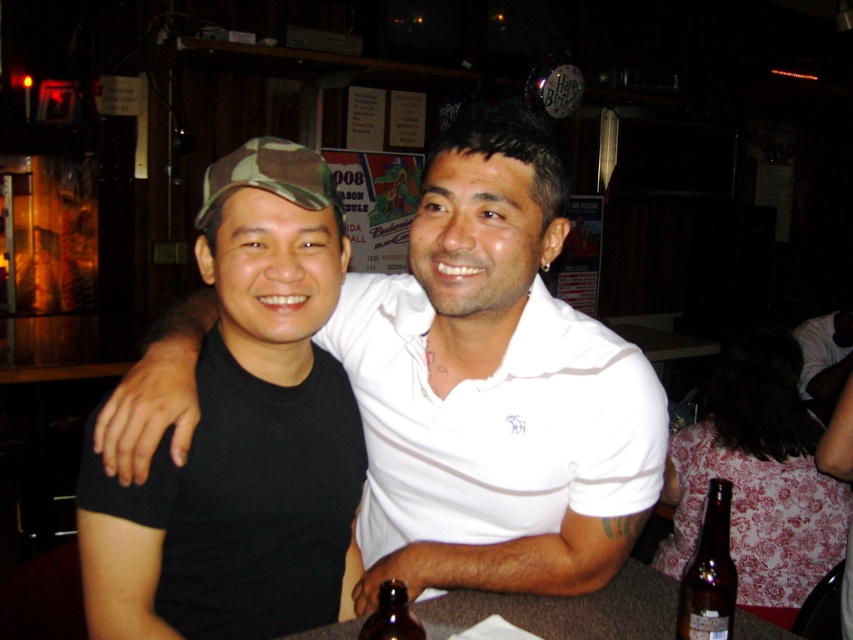
Question: Which object is farther from the camera taking this photo?

Choices:
 (A) black matte cap at left
 (B) brown glass bottle at lower center
 (C) black matte shirt at center
 (D) brown glass bottle at lower right

Answer: (D)

Question: Is brown matte table at lower center above brown glass bottle at lower right?

Choices:
 (A) yes
 (B) no

Answer: (B)

Question: Observing the image, what is the correct spatial positioning of black matte shirt at center in reference to brown glass bottle at lower center?

Choices:
 (A) below
 (B) above

Answer: (B)

Question: Which point is closer to the camera taking this photo?

Choices:
 (A) (695, 605)
 (B) (457, 604)

Answer: (A)

Question: Estimate the real-world distances between objects in this image. Which object is closer to the brown glass bottle at lower center?

Choices:
 (A) black matte cap at left
 (B) brown glass bottle at lower right

Answer: (A)

Question: Observing the image, what is the correct spatial positioning of black matte shirt at center in reference to black matte cap at left?

Choices:
 (A) right
 (B) left

Answer: (A)